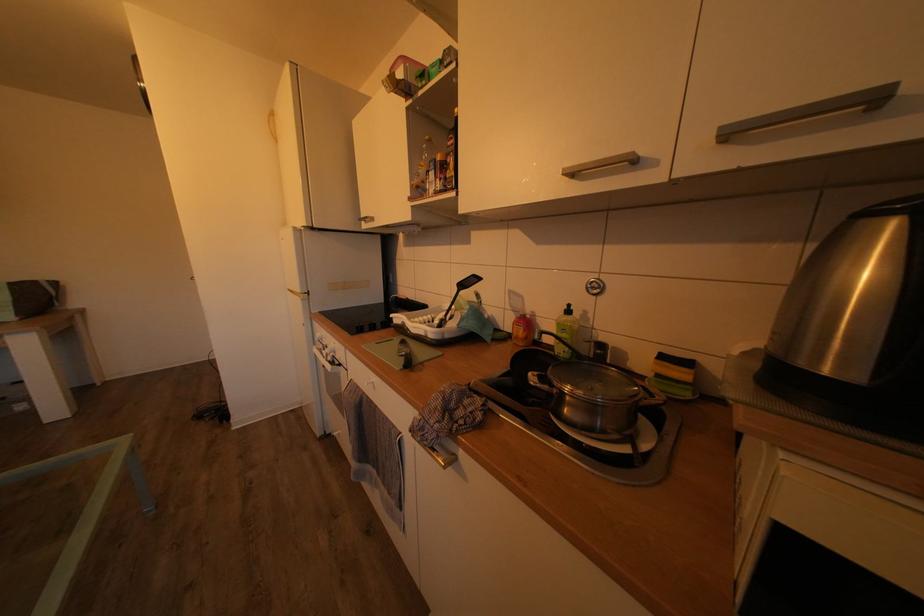
The height and width of the screenshot is (616, 924). Find the location of `soap dispenser pump`. soap dispenser pump is located at coordinates (572, 312).